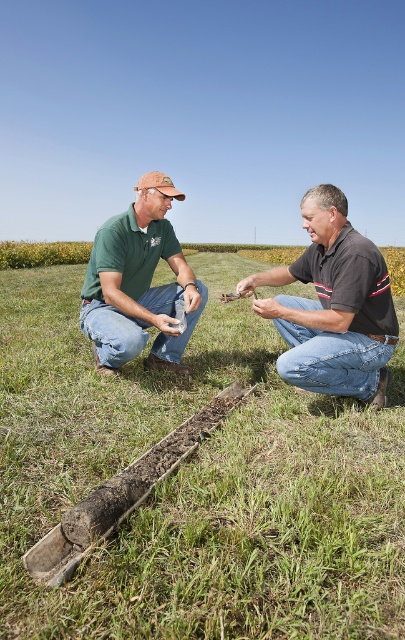
Which is in front, point (178, 554) or point (140, 232)?

Point (178, 554) is in front.

Between green grass at center and green matte shirt at center, which one is positioned higher?

green matte shirt at center

Is point (221, 348) closer to camera compared to point (151, 248)?

That is False.

Where is `green grass at center`? green grass at center is located at coordinates (196, 481).

Is green grass at center above black matte shirt at center?

Actually, green grass at center is below black matte shirt at center.

Does green grass at center have a greater width compared to black matte shirt at center?

Correct, the width of green grass at center exceeds that of black matte shirt at center.

Does point (63, 449) come farther from viewer compared to point (345, 280)?

No, (63, 449) is in front of (345, 280).

Image resolution: width=405 pixels, height=640 pixels. Find the location of `green grass at center`. green grass at center is located at coordinates pos(196,481).

Which of these two, black matte shirt at center or green matte shirt at center, stands shorter?

black matte shirt at center is shorter.

Who is more distant from viewer, (368, 278) or (104, 285)?

Point (104, 285)

Is point (338, 296) closer to viewer compared to point (144, 291)?

Yes.

At what (x,y) coordinates should I click in order to perform the action: click on black matte shirt at center. Please return your answer as a coordinate pair (x, y). This screenshot has height=640, width=405. Looking at the image, I should click on (332, 305).